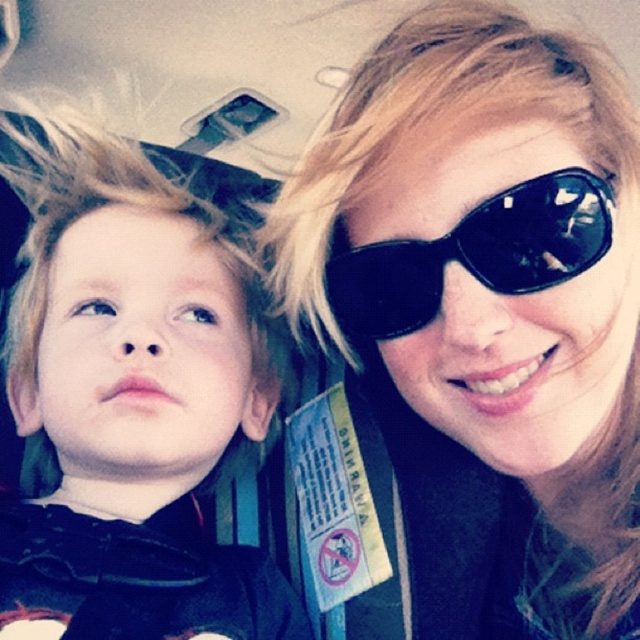
Question: Based on their relative distances, which object is farther from the black reflective sunglasses at upper right?

Choices:
 (A) blonde hair at left
 (B) black matte sunglasses at upper right

Answer: (A)

Question: Where is black matte sunglasses at upper right located in relation to blonde hair at left in the image?

Choices:
 (A) below
 (B) above

Answer: (A)

Question: Which is farther from the black reflective sunglasses at upper right?

Choices:
 (A) black matte sunglasses at upper right
 (B) blonde hair at left

Answer: (B)

Question: Does black matte sunglasses at upper right have a greater width compared to blonde hair at left?

Choices:
 (A) yes
 (B) no

Answer: (B)

Question: Which point is closer to the camera taking this photo?

Choices:
 (A) (20, 328)
 (B) (438, 184)

Answer: (B)

Question: Is blonde hair at left thinner than black reflective sunglasses at upper right?

Choices:
 (A) yes
 (B) no

Answer: (B)